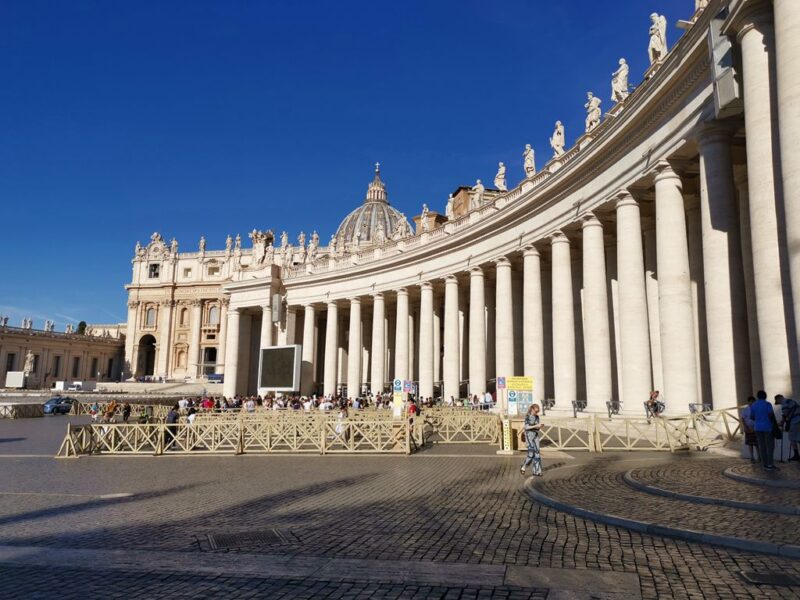
The width and height of the screenshot is (800, 600). In order to click on square screen to the middle left in this screenshot , I will do `click(280, 368)`.